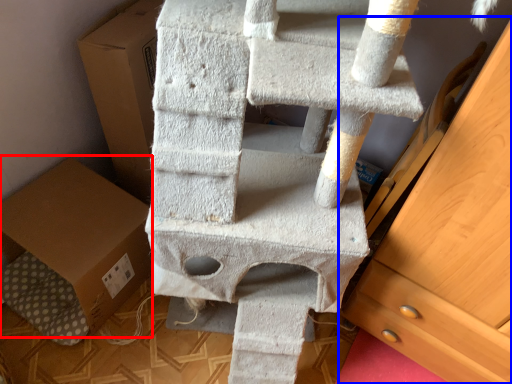
Question: Among these objects, which one is farthest to the camera, cardboard box (highlighted by a red box) or chest of drawers (highlighted by a blue box)?

Choices:
 (A) cardboard box
 (B) chest of drawers

Answer: (A)